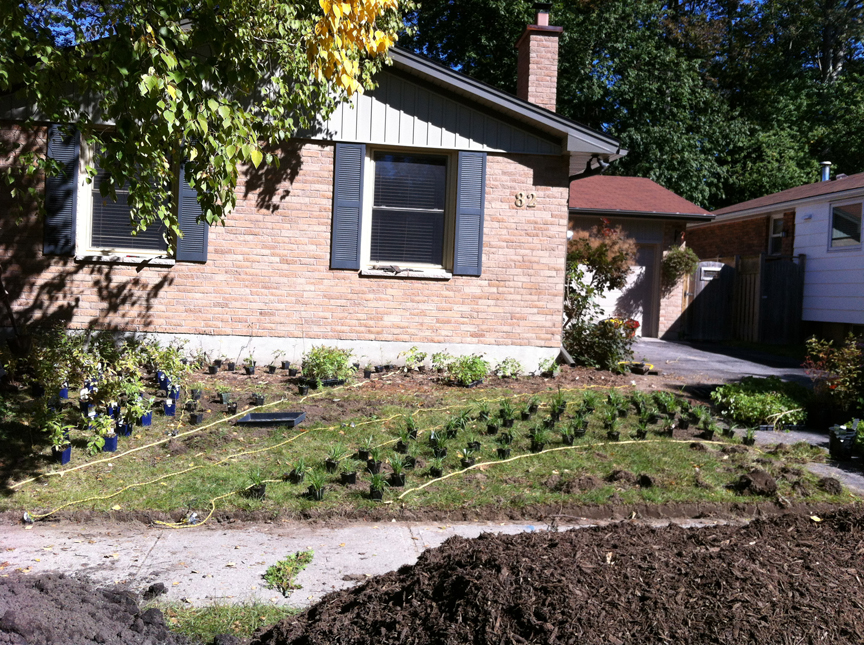
I want to click on potted grass, so click(x=378, y=484), click(x=448, y=453), click(x=509, y=449), click(x=574, y=426).